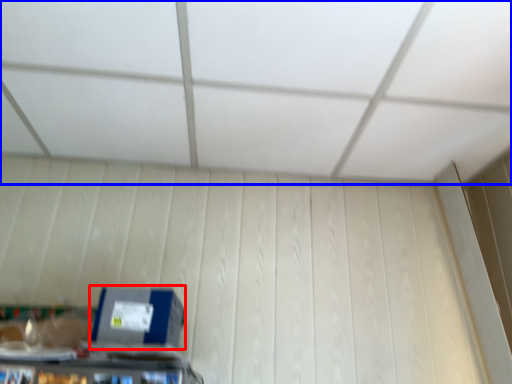
Question: Which object is further to the camera taking this photo, box (highlighted by a red box) or exhaust hood (highlighted by a blue box)?

Choices:
 (A) box
 (B) exhaust hood

Answer: (A)